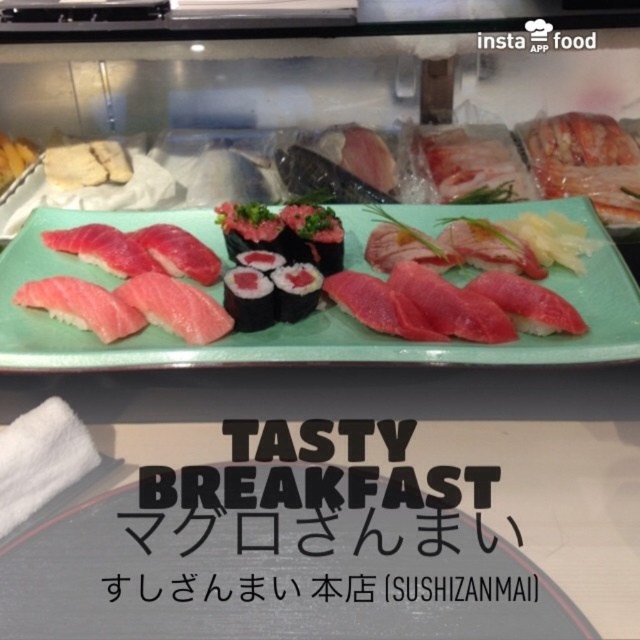
Based on the photo, between smokey pink rice at center and black rice ball at center, which one has more height?

smokey pink rice at center is taller.

Which is in front, point (248, 275) or point (294, 268)?

Point (248, 275) is more forward.

Find the location of `smokey pink rice at center`. smokey pink rice at center is located at coordinates (248, 298).

Does green ceramic plate at center appear over black rice ball at center?

Yes, green ceramic plate at center is above black rice ball at center.

Consider the image. Who is lower down, green ceramic plate at center or black rice ball at center?

Positioned lower is black rice ball at center.

Where is `green ceramic plate at center`? This screenshot has width=640, height=640. green ceramic plate at center is located at coordinates (314, 312).

Does black paper sign at center have a lesser height compared to black rice ball at center?

No, black paper sign at center is not shorter than black rice ball at center.

Between point (362, 440) and point (304, 314), which one is positioned in front?

Point (362, 440) is more forward.

Does point (129, 524) come in front of point (285, 266)?

Yes, point (129, 524) is in front of point (285, 266).

Locate an element on the screen. black paper sign at center is located at coordinates (307, 524).